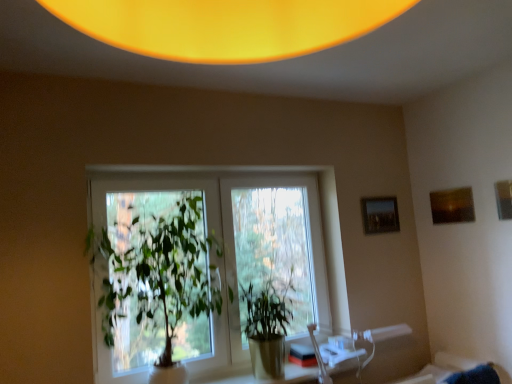
Question: Can you confirm if green leafy plant at center, the first houseplant from the left, is shorter than green glossy plant at center, the 1th houseplant from the right?

Choices:
 (A) yes
 (B) no

Answer: (B)

Question: Is green leafy plant at center, which is the 2th houseplant from right to left, not near green glossy plant at center, acting as the 2th houseplant starting from the left?

Choices:
 (A) yes
 (B) no

Answer: (B)

Question: Is green leafy plant at center, the first houseplant from the left, taller than green glossy plant at center, acting as the 2th houseplant starting from the left?

Choices:
 (A) yes
 (B) no

Answer: (A)

Question: From the image's perspective, is green leafy plant at center, which is the 2th houseplant from right to left, under green glossy plant at center, the 1th houseplant from the right?

Choices:
 (A) yes
 (B) no

Answer: (B)

Question: Is green leafy plant at center, the first houseplant from the left, touching green glossy plant at center, the 1th houseplant from the right?

Choices:
 (A) no
 (B) yes

Answer: (A)

Question: Could you tell me if green leafy plant at center, which is the 2th houseplant from right to left, is facing green glossy plant at center, acting as the 2th houseplant starting from the left?

Choices:
 (A) no
 (B) yes

Answer: (A)

Question: Is translucent glass table at center bigger than clear glass window at center?

Choices:
 (A) yes
 (B) no

Answer: (B)

Question: Is translucent glass table at center looking in the opposite direction of clear glass window at center?

Choices:
 (A) no
 (B) yes

Answer: (B)

Question: From the image's perspective, is translucent glass table at center on top of clear glass window at center?

Choices:
 (A) no
 (B) yes

Answer: (A)

Question: Is translucent glass table at center positioned in front of clear glass window at center?

Choices:
 (A) yes
 (B) no

Answer: (A)

Question: Is translucent glass table at center outside clear glass window at center?

Choices:
 (A) no
 (B) yes

Answer: (B)

Question: Does translucent glass table at center have a lesser width compared to clear glass window at center?

Choices:
 (A) yes
 (B) no

Answer: (B)

Question: Is matte brown picture frame at upper right, which is the 2th picture frame from left to right, positioned with its back to green glossy plant at center, the 1th houseplant from the right?

Choices:
 (A) no
 (B) yes

Answer: (A)